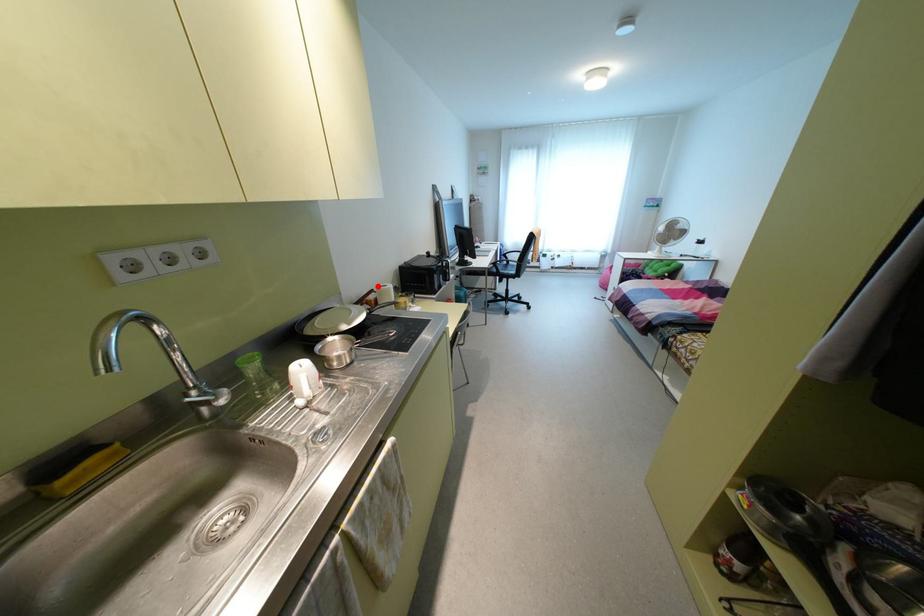
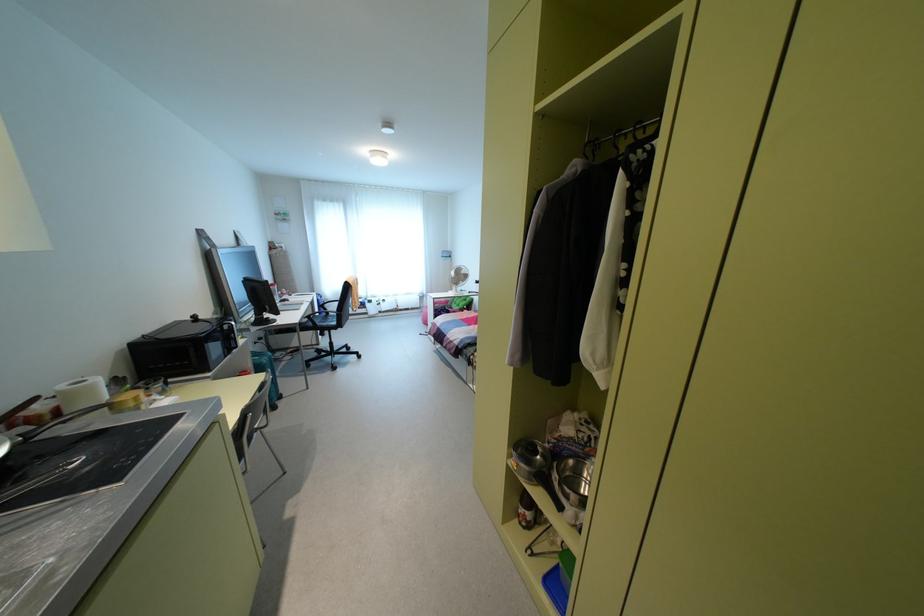
Question: I am providing you with two images of the same scene from different viewpoints. Image1 has a red point marked. In image2, the corresponding 3D location appears at what relative position? Reply with the corresponding letter.

Choices:
 (A) Closer
 (B) Farther

Answer: (B)